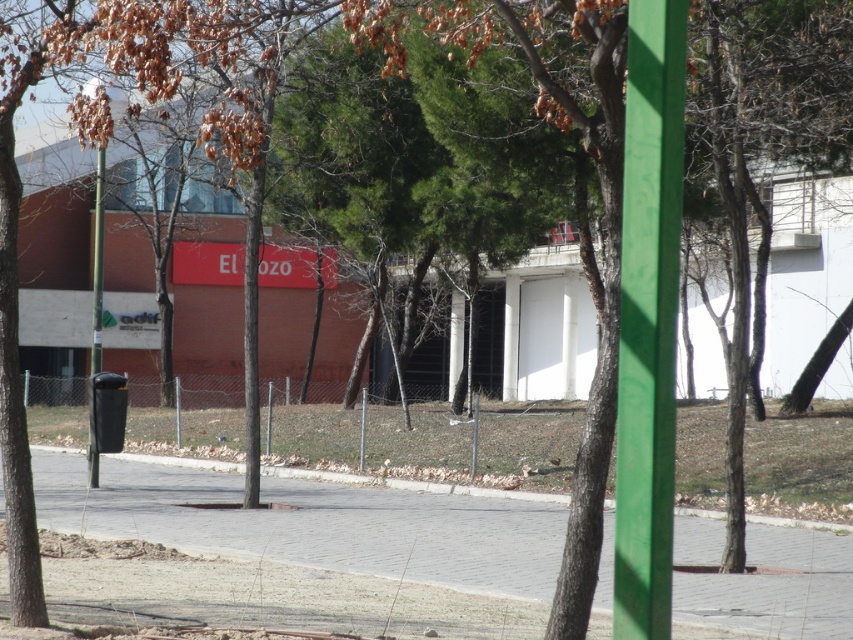
Does point (538, 552) come in front of point (97, 474)?

Yes, it is.

You are a GUI agent. You are given a task and a screenshot of the screen. Output one action in this format:
    pyautogui.click(x=<x>, y=<y>)
    Task: Click on the brick pavement at center
    This screenshot has height=640, width=853.
    Given the screenshot: What is the action you would take?
    pyautogui.click(x=314, y=524)

Is point (457, 522) positioned before point (94, 353)?

Yes.

You are a GUI agent. You are given a task and a screenshot of the screen. Output one action in this format:
    pyautogui.click(x=<x>, y=<y>)
    Task: Click on the brick pavement at center
    
    Given the screenshot: What is the action you would take?
    pyautogui.click(x=314, y=524)

Image resolution: width=853 pixels, height=640 pixels. What are the coordinates of `brick pavement at center` in the screenshot? It's located at (314, 524).

Locate an element on the screen. brick pavement at center is located at coordinates (314, 524).

Is green painted pole at right smaller than black plastic pole at left?

Yes, green painted pole at right is smaller than black plastic pole at left.

You are a GUI agent. You are given a task and a screenshot of the screen. Output one action in this format:
    pyautogui.click(x=<x>, y=<y>)
    Task: Click on the green painted pole at right
    
    Given the screenshot: What is the action you would take?
    pyautogui.click(x=648, y=317)

At what (x,y) coordinates should I click in order to perform the action: click on green painted pole at right. Please return your answer as a coordinate pair (x, y). The width and height of the screenshot is (853, 640). Looking at the image, I should click on (648, 317).